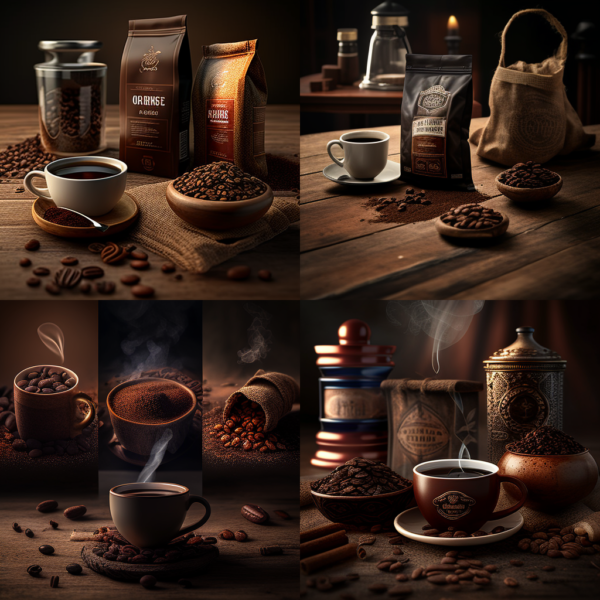
I want to click on coffee cups, so click(x=366, y=150), click(x=92, y=193), click(x=153, y=514), click(x=475, y=502).